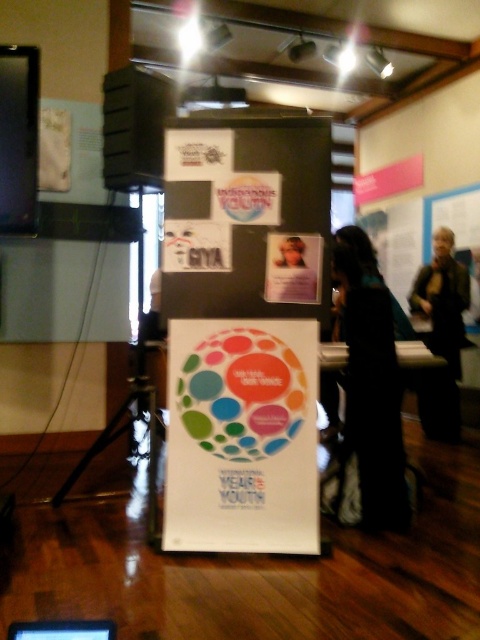
You are an event planner standing in front of the display stand. You need to adjust the lighting so that both the multicolored glossy poster at center and the matte plastic photo frame at center are well illuminated. Which object should you focus the spotlight on first to ensure both are lit properly?

The multicolored glossy poster at center is closer to the viewer than the matte plastic photo frame at center. Therefore, you should first adjust the spotlight to illuminate the multicolored glossy poster at center, ensuring it is properly lit before adjusting for the matte plastic photo frame at center.